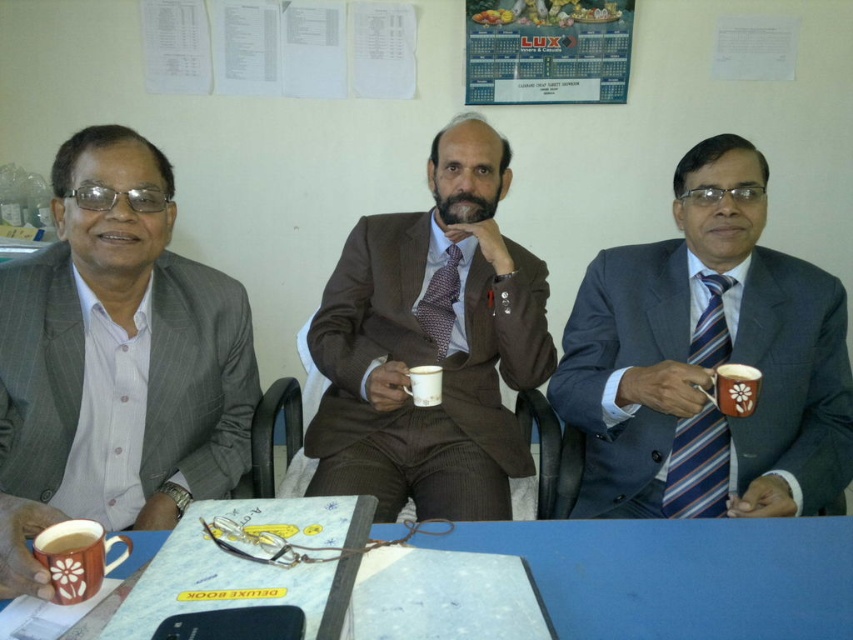
You are a delivery robot with a 12 inch wide package. You need to place it on the table between the matte gray suit at left and the white ceramic mug at center. Is there enough space?

The distance between the matte gray suit at left and the white ceramic mug at center is 18.36 inches. Since the package is 12 inches wide, there is sufficient space to place it between them.

You are a photographer standing at a distance of 1.5 meters from the table where the three men are seated. You want to take a closeup photo of the brown textured suit at center without moving any of the subjects. Is the current distance sufficient to capture the suit clearly in the frame?

The brown textured suit at center is 1.36 meters from the camera, which is within your 1.5 meters distance. Therefore, the current distance is sufficient to capture the brown textured suit at center clearly in the frame.

Please look at the coordinates provided. What item is located at point (706, 362) in the image?

The blue striped tie at center is located at point (706, 362).